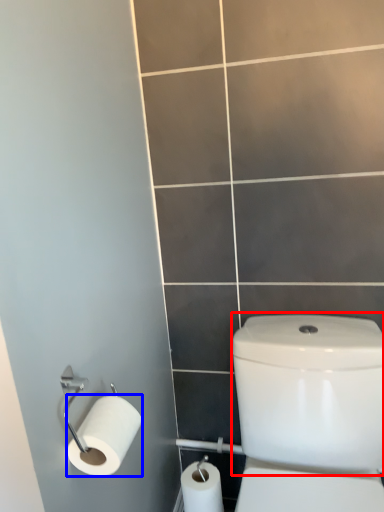
Question: Which point is closer to the camera, water tank (highlighted by a red box) or toilet paper (highlighted by a blue box)?

Choices:
 (A) water tank
 (B) toilet paper

Answer: (A)